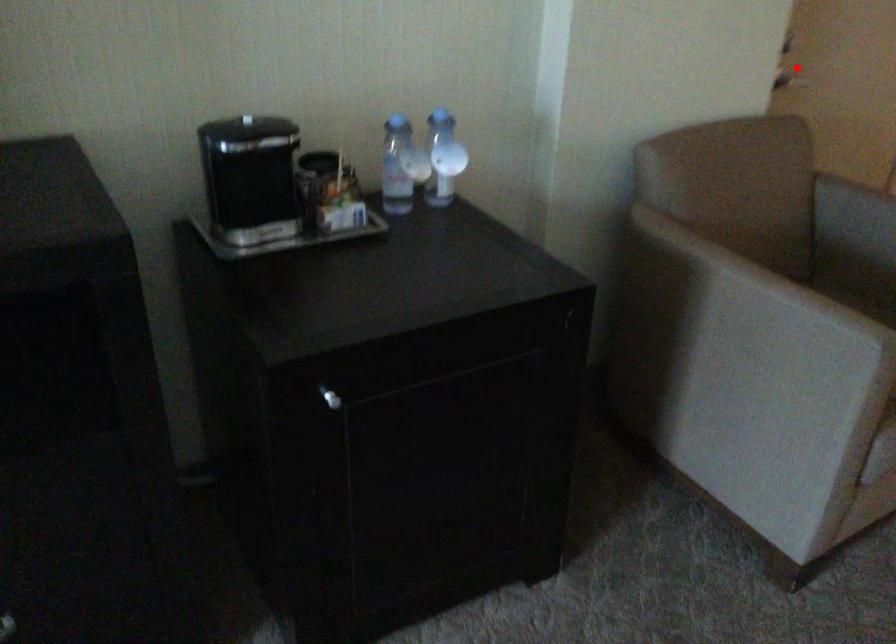
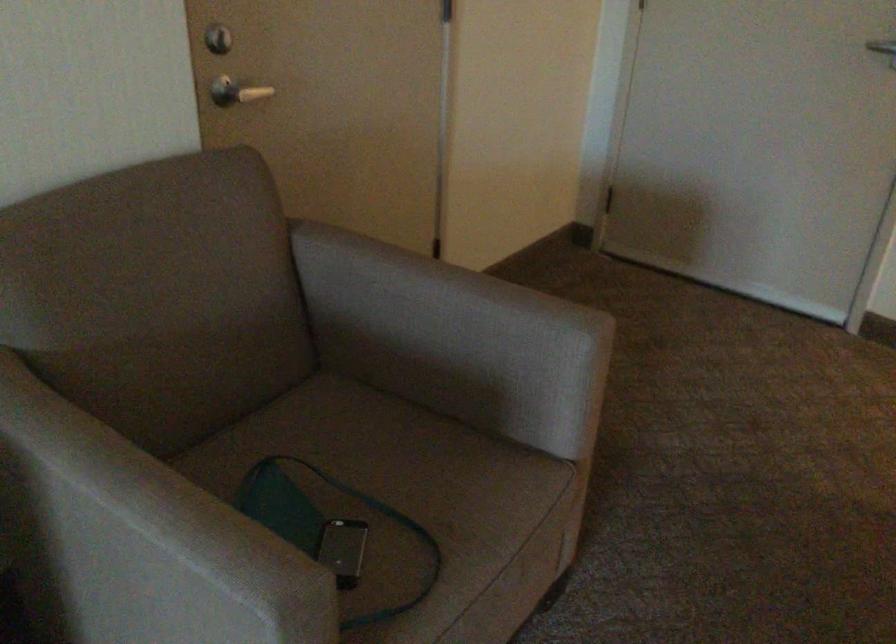
The point at the highlighted location is marked in the first image. Where is the corresponding point in the second image?

(236, 91)